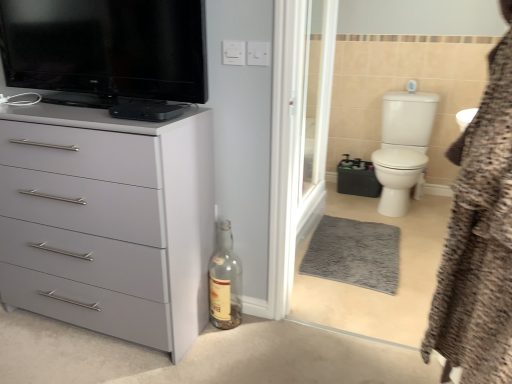
Find the location of a particular element. This screenshot has height=384, width=512. vacant area situated to the left side of white glossy toilet bowl at right is located at coordinates (347, 208).